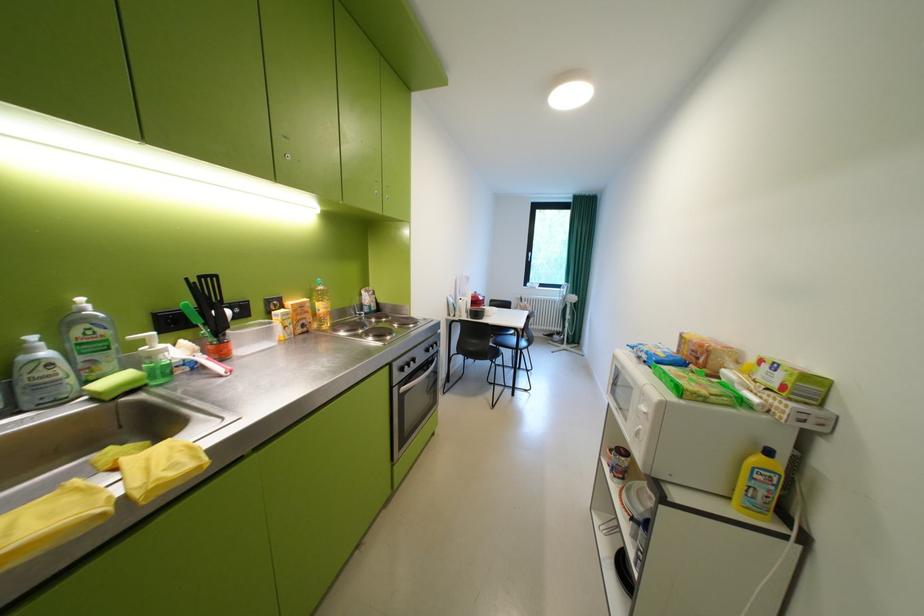
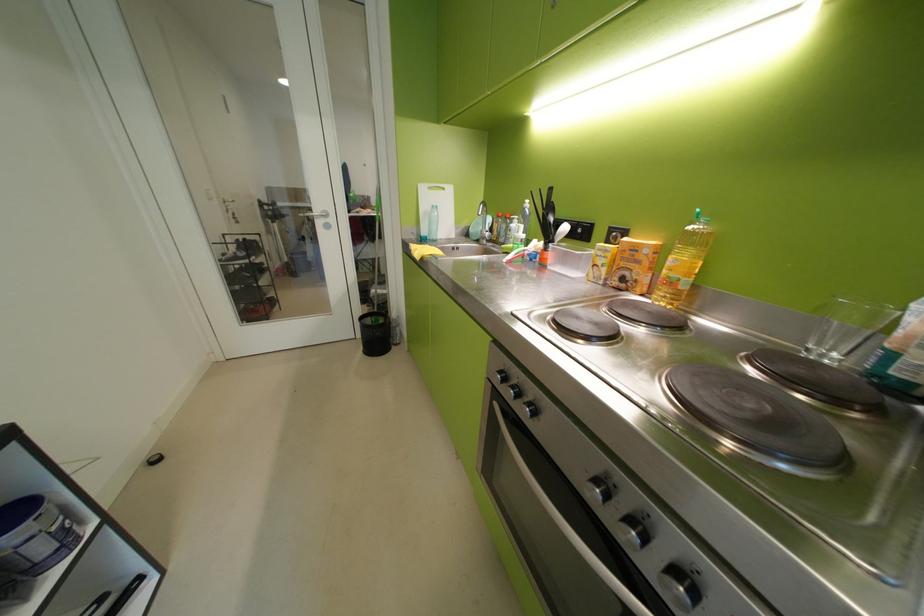
Locate, in the second image, the point that corresponds to point (311, 306) in the first image.

(646, 249)